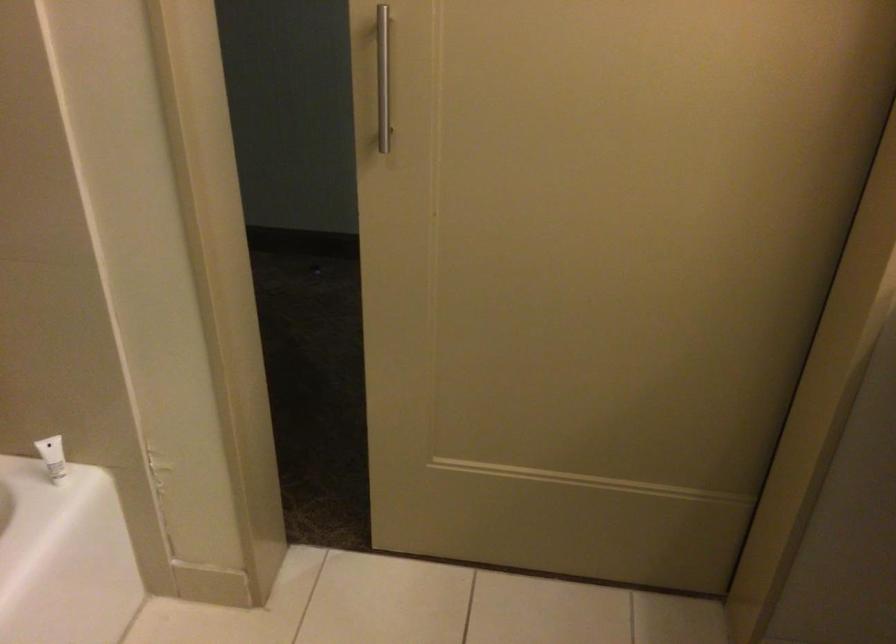
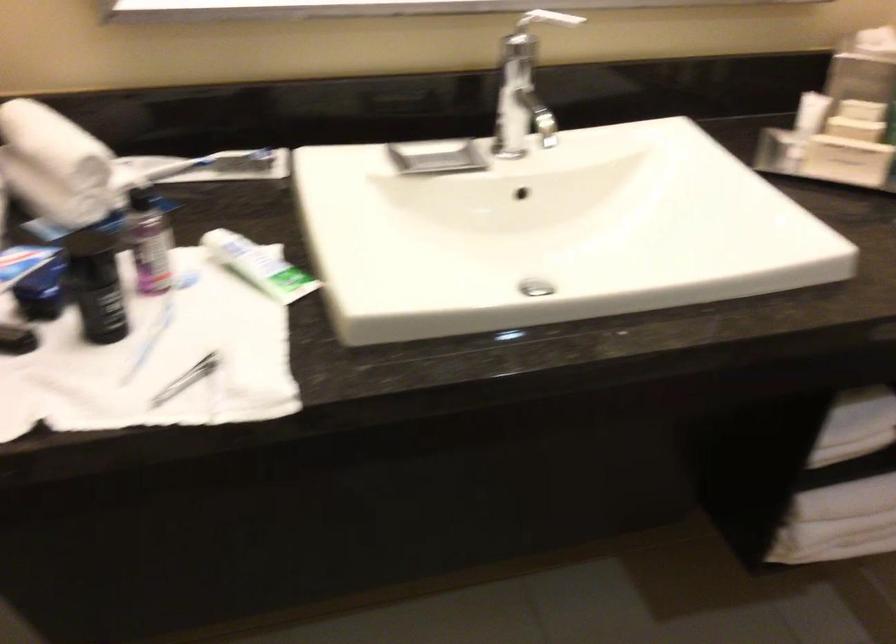
The first image is from the beginning of the video and the second image is from the end. How did the camera likely rotate when shooting the video?

The camera's rotation is toward right-down.